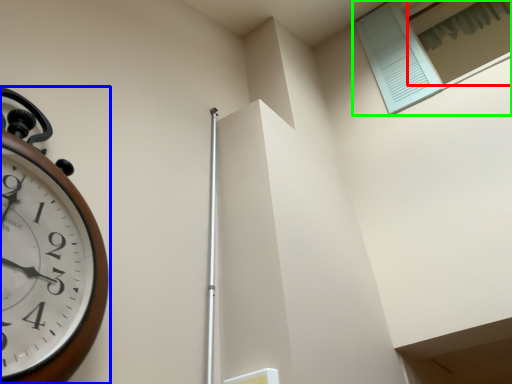
Question: Which object is the closest to the window (highlighted by a red box)? Choose among these: wall clock (highlighted by a blue box) or window (highlighted by a green box).

Choices:
 (A) wall clock
 (B) window

Answer: (B)